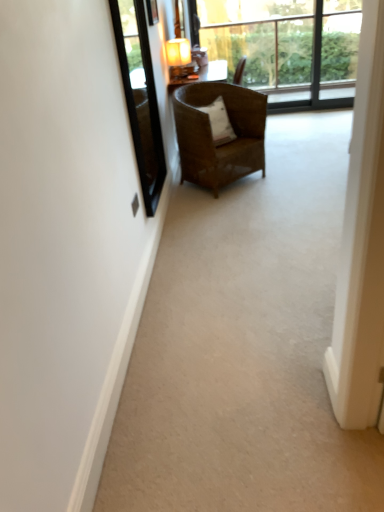
Where is `free location in front of brown woven chair at center`? This screenshot has height=512, width=384. free location in front of brown woven chair at center is located at coordinates (254, 201).